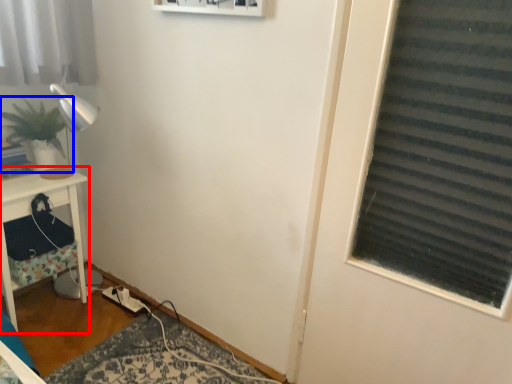
Question: Which of the following is the farthest to the observer, furniture (highlighted by a red box) or houseplant (highlighted by a blue box)?

Choices:
 (A) furniture
 (B) houseplant

Answer: (B)